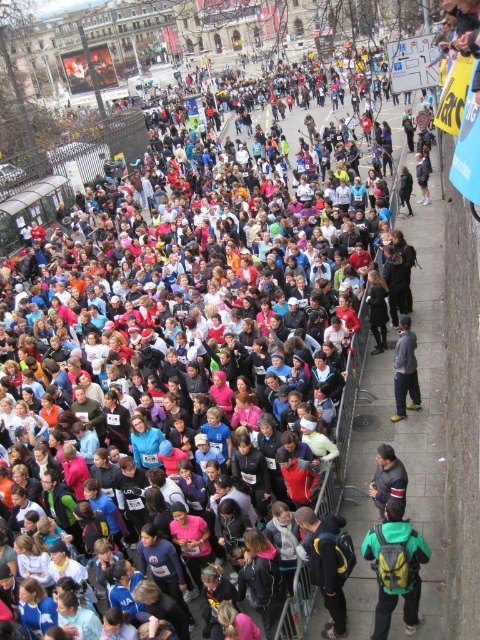
You are a photographer trying to capture a photo of the crowd at the event. You notice two jackets at the center of the scene, a dark blue jacket at center and a gray fabric jacket at center. Which jacket would block your view more if they are both facing forward?

The dark blue jacket at center might block your view more than the gray fabric jacket at center since it is wider according to the description.